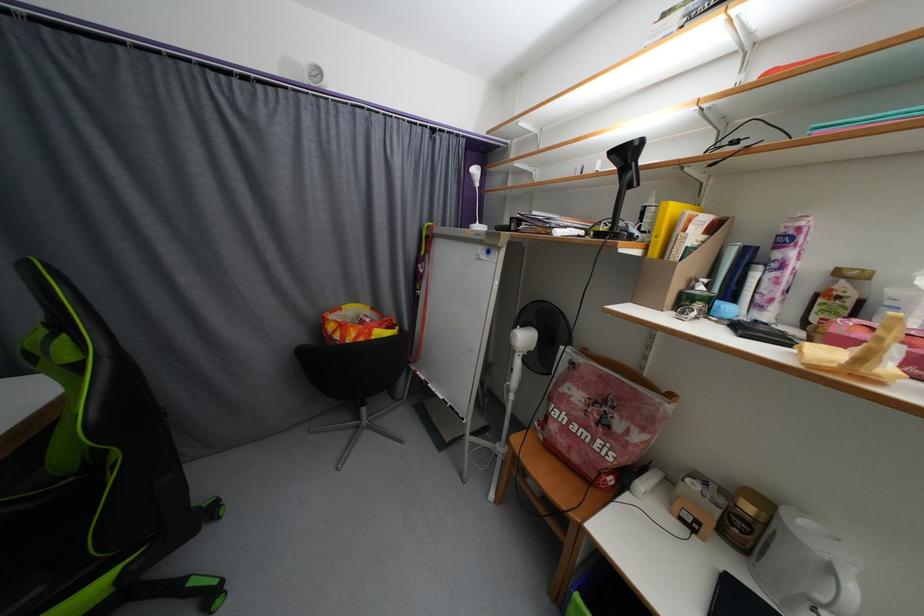
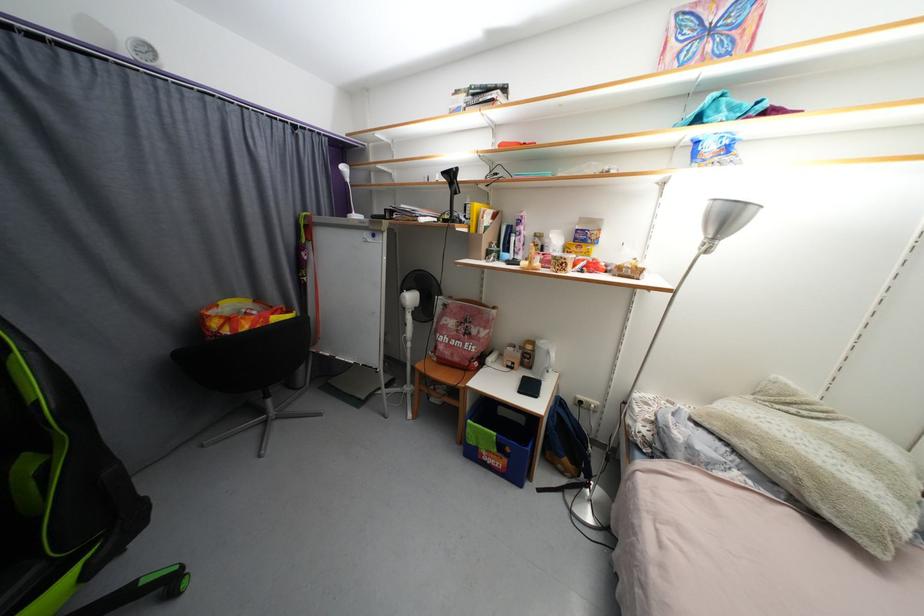
Where in the second image is the point corresponding to pixel 772 507 from the first image?

(538, 344)